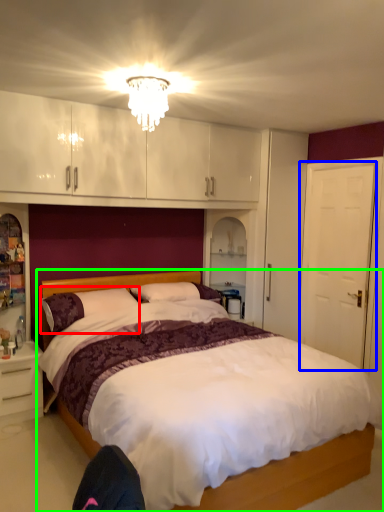
Question: Which object is positioned closest to pillow (highlighted by a red box)? Select from door (highlighted by a blue box) and bed (highlighted by a green box).

Choices:
 (A) door
 (B) bed

Answer: (B)